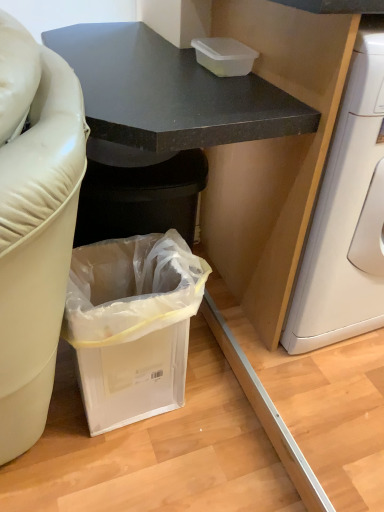
Question: Is clear plastic trash can at lower left wider than matte black cabinet at lower left?

Choices:
 (A) yes
 (B) no

Answer: (B)

Question: Is clear plastic trash can at lower left completely or partially outside of matte black cabinet at lower left?

Choices:
 (A) yes
 (B) no

Answer: (B)

Question: Is matte black cabinet at lower left at the back of clear plastic trash can at lower left?

Choices:
 (A) yes
 (B) no

Answer: (A)

Question: Is clear plastic trash can at lower left to the left of matte black cabinet at lower left from the viewer's perspective?

Choices:
 (A) no
 (B) yes

Answer: (A)

Question: From a real-world perspective, is clear plastic trash can at lower left on top of matte black cabinet at lower left?

Choices:
 (A) no
 (B) yes

Answer: (A)

Question: Is transparent plastic container at upper center inside or outside of clear plastic trash can at lower left?

Choices:
 (A) outside
 (B) inside

Answer: (A)

Question: In terms of height, does transparent plastic container at upper center look taller or shorter compared to clear plastic trash can at lower left?

Choices:
 (A) short
 (B) tall

Answer: (A)

Question: Is transparent plastic container at upper center wider or thinner than clear plastic trash can at lower left?

Choices:
 (A) thin
 (B) wide

Answer: (A)

Question: Looking at the image, does transparent plastic container at upper center seem bigger or smaller compared to clear plastic trash can at lower left?

Choices:
 (A) small
 (B) big

Answer: (A)

Question: From the image's perspective, is clear plastic trash can at lower left above or below matte black cabinet at lower left?

Choices:
 (A) above
 (B) below

Answer: (B)

Question: Is point (77, 360) closer or farther from the camera than point (127, 136)?

Choices:
 (A) closer
 (B) farther

Answer: (B)

Question: From their relative heights in the image, would you say clear plastic trash can at lower left is taller or shorter than matte black cabinet at lower left?

Choices:
 (A) short
 (B) tall

Answer: (A)

Question: In the image, is clear plastic trash can at lower left on the left side or the right side of matte black cabinet at lower left?

Choices:
 (A) left
 (B) right

Answer: (B)

Question: From a real-world perspective, is transparent plastic container at upper center above or below matte black cabinet at lower left?

Choices:
 (A) above
 (B) below

Answer: (A)

Question: Based on their sizes in the image, would you say transparent plastic container at upper center is bigger or smaller than matte black cabinet at lower left?

Choices:
 (A) small
 (B) big

Answer: (A)